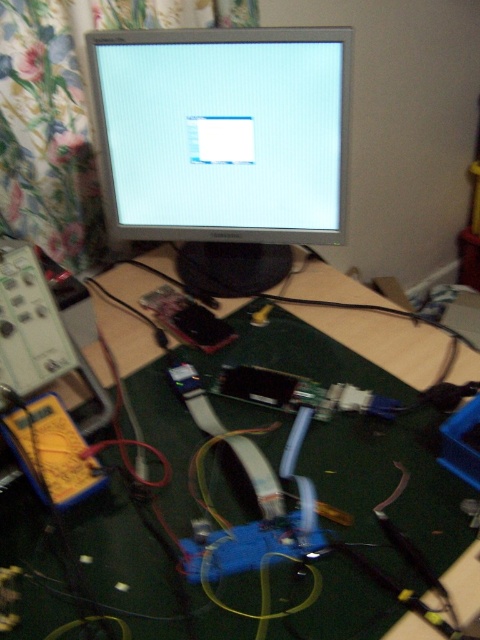
You are setting up a new workspace and need to place a large rectangular box that is 1.2 meters wide on the desk. Given the current setup with the silver metallic monitor at center and the green fabric table at center, will the box fit on the table without overlapping the monitor?

The silver metallic monitor at center has a lesser width compared to the green fabric table at center. Since the monitor is narrower than the table, the 1.2 meter wide box might fit if positioned away from the monitor. However, the exact placement depends on the table dimensions and the monitor position.

You are setting up a new workspace and need to place a large tool on the desk. Given the current setup, can the silver metallic monitor at center be moved to make more space for the tool without removing the green fabric table at center?

The silver metallic monitor at center occupies less space than green fabric table at center, so moving it could free up some space for the tool without needing to remove the green fabric table at center.

You are standing in front of the workspace and want to reach the point at coordinates [216,260]. Can you comfortably reach it without moving your feet?

The point at coordinates [216,260] is 1.26 meters away from the viewer, which is within comfortable reaching distance for most people, so yes, you can comfortably reach it without moving your feet.